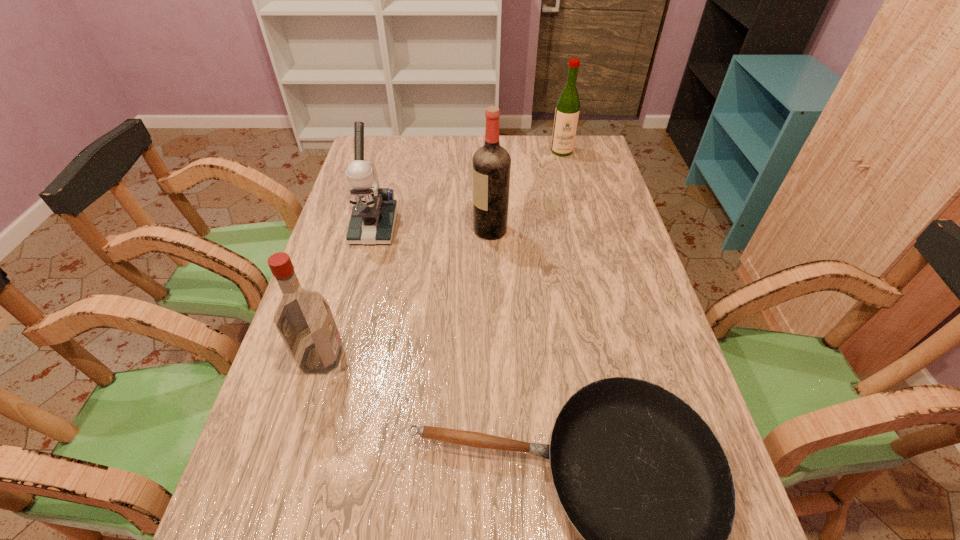
The width and height of the screenshot is (960, 540). Identify the location of free space between the leftmost liquor and the farthest object. (442, 254).

I want to click on vacant area that lies between the rightmost liquor and the second nearest liquor, so click(526, 191).

At what (x,y) coordinates should I click in order to perform the action: click on free spot between the rightmost liquor and the microscope. Please return your answer as a coordinate pair (x, y). Looking at the image, I should click on (468, 190).

You are a GUI agent. You are given a task and a screenshot of the screen. Output one action in this format:
    pyautogui.click(x=<x>, y=<y>)
    Task: Click on the free point between the fourth farthest object and the microscope
    This screenshot has height=540, width=960.
    Given the screenshot: What is the action you would take?
    pyautogui.click(x=348, y=293)

The width and height of the screenshot is (960, 540). What are the coordinates of `vacant area that lies between the second liquor from left to right and the microscope` in the screenshot? It's located at (432, 229).

Where is `free space that is in between the microscope and the farthest liquor`? This screenshot has height=540, width=960. free space that is in between the microscope and the farthest liquor is located at coordinates coord(468,190).

At what (x,y) coordinates should I click in order to perform the action: click on vacant area that lies between the nearest liquor and the microscope. Please return your answer as a coordinate pair (x, y). Looking at the image, I should click on (348, 293).

Locate an element on the screen. This screenshot has width=960, height=540. the second closest object to the shortest object is located at coordinates (374, 213).

Identify which object is the second closest to the microscope. Please provide its 2D coordinates. Your answer should be formatted as a tuple, i.e. [(x, y)], where the tuple contains the x and y coordinates of a point satisfying the conditions above.

[(303, 318)]

Where is `liquor that is the second closest to the farthest object`? Image resolution: width=960 pixels, height=540 pixels. liquor that is the second closest to the farthest object is located at coordinates (303, 318).